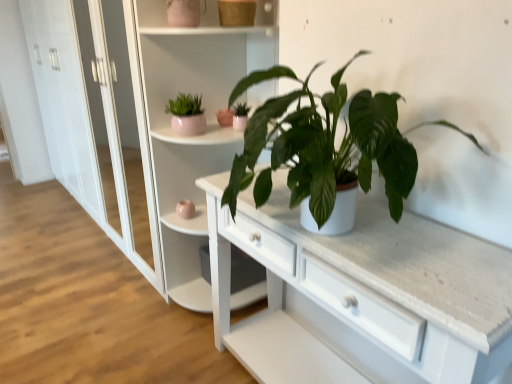
Question: In terms of height, does white glossy bookshelf at upper center look taller or shorter compared to matte white pot at center, arranged as the second houseplant when viewed from the right?

Choices:
 (A) short
 (B) tall

Answer: (B)

Question: Is white glossy bookshelf at upper center wider or thinner than matte white pot at center, marked as the second houseplant in a left-to-right arrangement?

Choices:
 (A) wide
 (B) thin

Answer: (A)

Question: Which of these objects is positioned farthest from the pink ceramic flowerpot at upper center?

Choices:
 (A) matte white pot at center, the third houseplant positioned from the front
 (B) white glossy bookshelf at upper center
 (C) green matte plant at center, marked as the first houseplant in a right-to-left arrangement
 (D) matte pink pot at upper left, the third houseplant viewed from the right

Answer: (C)

Question: Based on their relative distances, which object is farther from the matte white pot at center, marked as the second houseplant in a left-to-right arrangement?

Choices:
 (A) green matte plant at center, marked as the first houseplant in a right-to-left arrangement
 (B) matte pink pot at upper left, the third houseplant viewed from the right
 (C) white glossy bookshelf at upper center
 (D) pink ceramic flowerpot at upper center

Answer: (A)